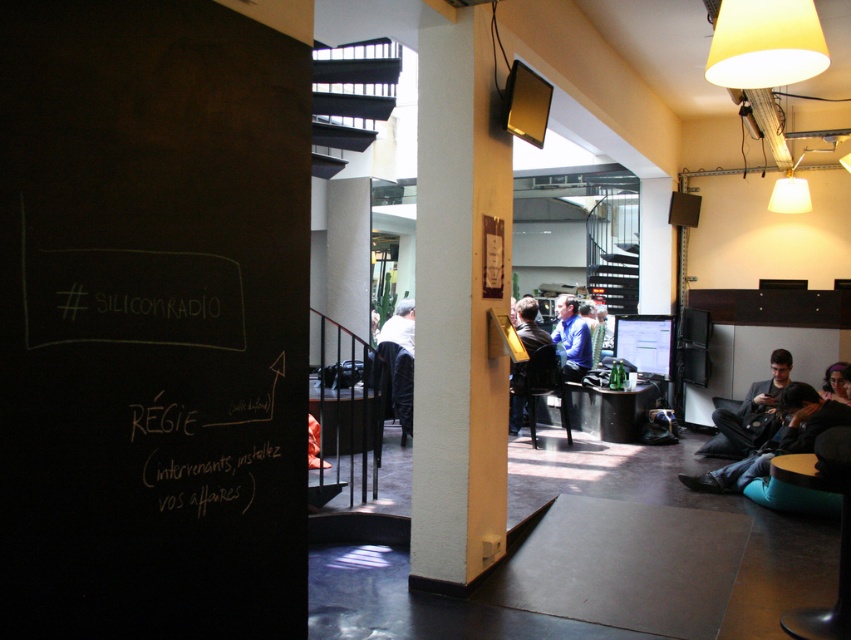
You are a GUI agent. You are given a task and a screenshot of the screen. Output one action in this format:
    pyautogui.click(x=<x>, y=<y>)
    Task: Click on the dark blue jeans at lower right
    
    Given the screenshot: What is the action you would take?
    pyautogui.click(x=777, y=440)

The width and height of the screenshot is (851, 640). Identify the location of dark blue jeans at lower right. (777, 440).

The width and height of the screenshot is (851, 640). I want to click on dark blue jeans at lower right, so (777, 440).

Which is more to the left, blue fabric shirt at center or dark blue shirt at center?

From the viewer's perspective, dark blue shirt at center appears more on the left side.

How far apart are blue fabric shirt at center and dark blue shirt at center?

blue fabric shirt at center is 28.23 inches away from dark blue shirt at center.

Measure the distance between blue fabric shirt at center and camera.

blue fabric shirt at center is 23.83 feet from camera.

Image resolution: width=851 pixels, height=640 pixels. In order to click on blue fabric shirt at center in this screenshot , I will do `click(572, 339)`.

In the scene shown: Can you confirm if dark gray suit at lower right is wider than light brown leather jacket at center?

Yes.

Does point (717, 403) come behind point (407, 321)?

No, (717, 403) is in front of (407, 321).

Describe the element at coordinates (749, 413) in the screenshot. I see `dark gray suit at lower right` at that location.

You are a GUI agent. You are given a task and a screenshot of the screen. Output one action in this format:
    pyautogui.click(x=<x>, y=<y>)
    Task: Click on the dark gray suit at lower right
    The image size is (851, 640).
    Given the screenshot: What is the action you would take?
    pyautogui.click(x=749, y=413)